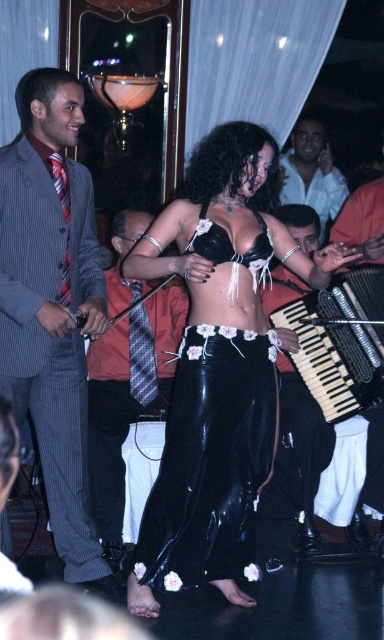
Is light blue shirt at center shorter than black satin bikini top at center?

No, light blue shirt at center is not shorter than black satin bikini top at center.

The image size is (384, 640). In order to click on light blue shirt at center in this screenshot , I will do `click(311, 173)`.

At what (x,y) coordinates should I click in order to perform the action: click on light blue shirt at center. Please return your answer as a coordinate pair (x, y). Looking at the image, I should click on (311, 173).

Is point (46, 104) farther from viewer compared to point (261, 257)?

No, it is in front of (261, 257).

Which is below, striped fabric suit at left or black satin bikini top at center?

striped fabric suit at left is lower down.

Who is more distant from viewer, (49, 348) or (196, 234)?

Point (196, 234)

This screenshot has width=384, height=640. Find the location of `striped fabric suit at left`. striped fabric suit at left is located at coordinates (52, 307).

Who is taller, black shiny skirt at center or light blue shirt at center?

black shiny skirt at center

Find the location of a particular element. black shiny skirt at center is located at coordinates (218, 365).